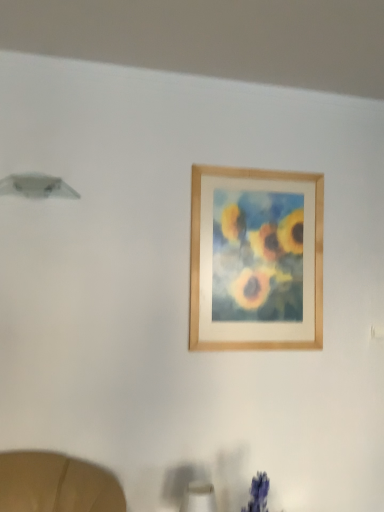
Question: From their relative heights in the image, would you say white matte table lamp at lower center is taller or shorter than wooden frame at upper center?

Choices:
 (A) tall
 (B) short

Answer: (B)

Question: Is white matte table lamp at lower center bigger or smaller than wooden frame at upper center?

Choices:
 (A) small
 (B) big

Answer: (A)

Question: From a real-world perspective, is white matte table lamp at lower center physically located above or below wooden frame at upper center?

Choices:
 (A) below
 (B) above

Answer: (A)

Question: In terms of height, does wooden frame at upper center look taller or shorter compared to white matte table lamp at lower center?

Choices:
 (A) short
 (B) tall

Answer: (B)

Question: Based on their sizes in the image, would you say wooden frame at upper center is bigger or smaller than white matte table lamp at lower center?

Choices:
 (A) small
 (B) big

Answer: (B)

Question: Is wooden frame at upper center in front of or behind white matte table lamp at lower center in the image?

Choices:
 (A) behind
 (B) front

Answer: (A)

Question: Is wooden frame at upper center wider or thinner than white matte table lamp at lower center?

Choices:
 (A) wide
 (B) thin

Answer: (B)